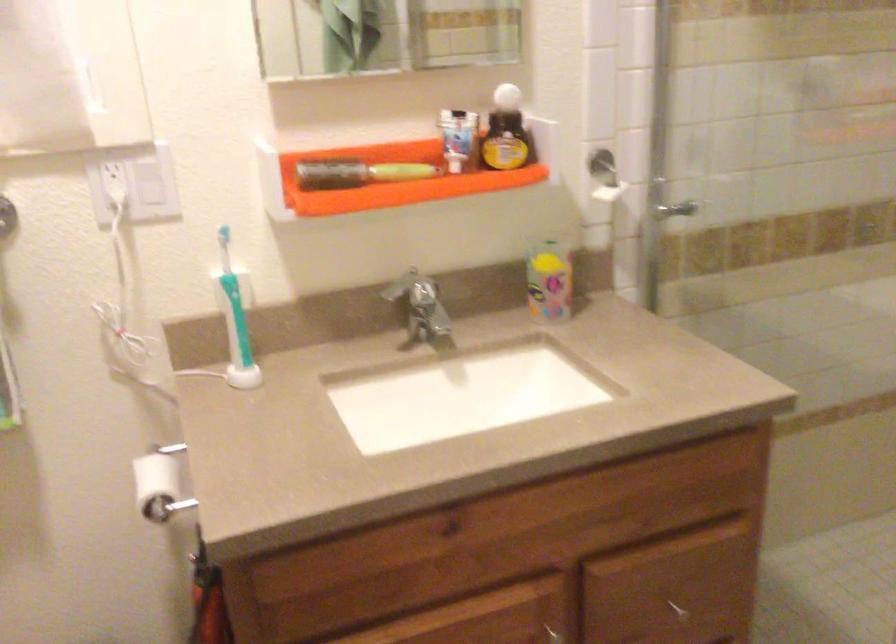
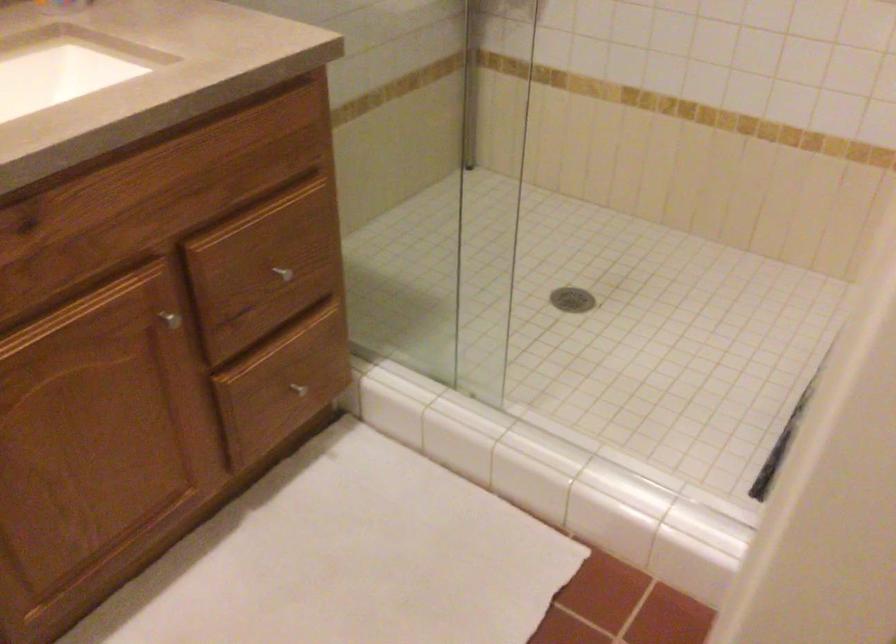
First-person continuous shooting, in which direction is the camera rotating?

The camera's rotation is toward right-down.